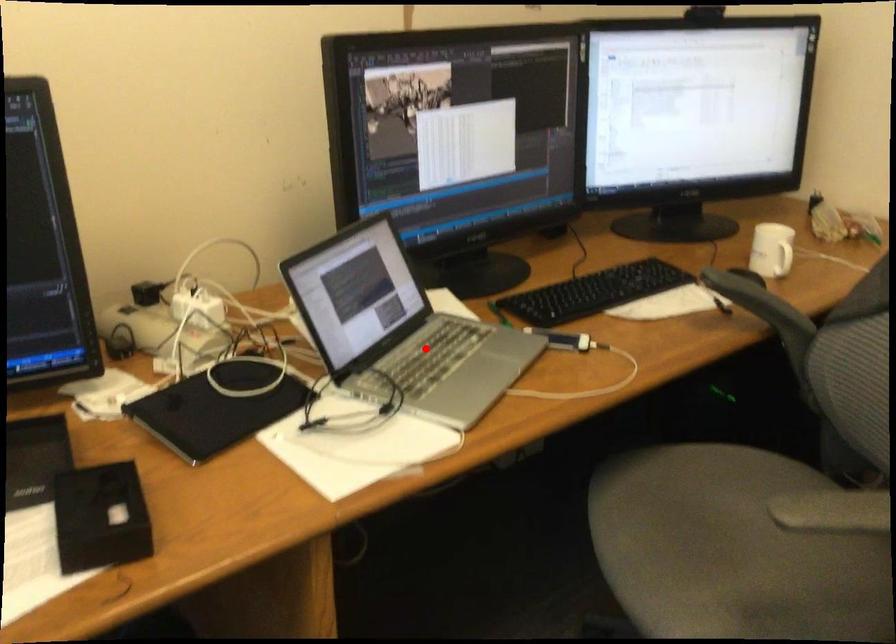
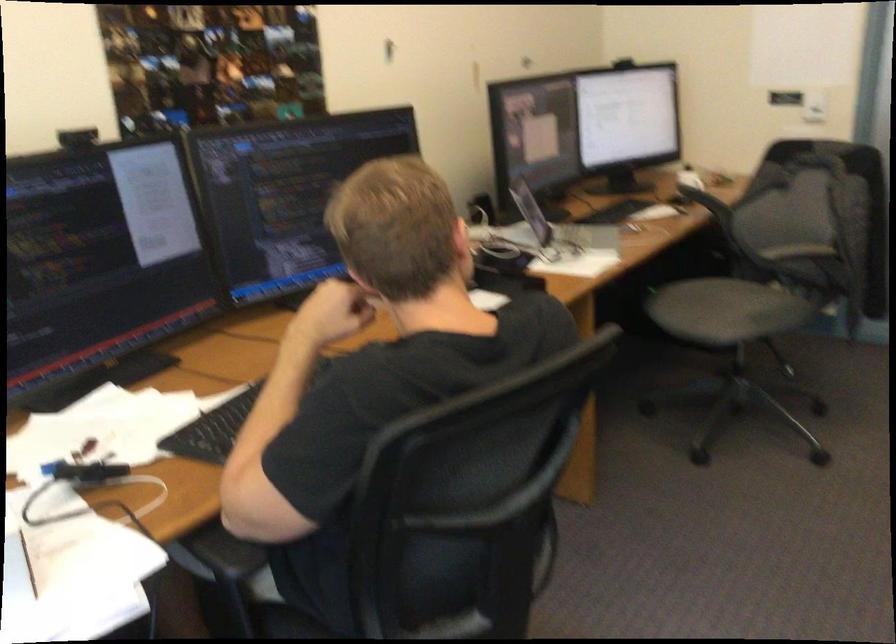
Question: A red point is marked in image1. In image2, is the corresponding 3D point closer to the camera or farther? Reply with the corresponding letter.

Choices:
 (A) The corresponding 3D point is closer.
 (B) The corresponding 3D point is farther.

Answer: (B)